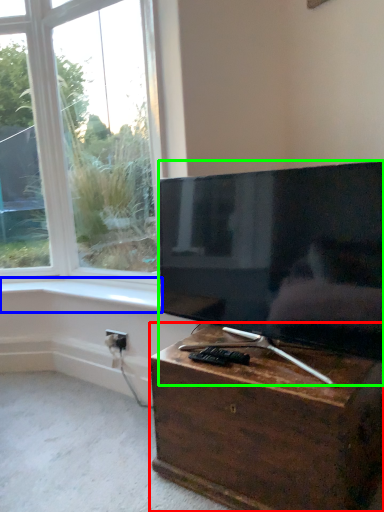
Question: Estimate the real-world distances between objects in this image. Which object is farther from nightstand (highlighted by a red box), window sill (highlighted by a blue box) or television (highlighted by a green box)?

Choices:
 (A) window sill
 (B) television

Answer: (A)